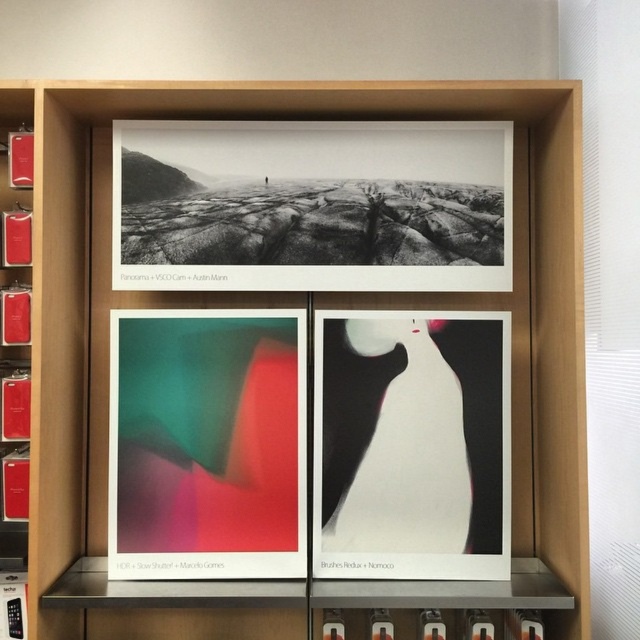
Is matte plastic poster at center above white glossy vase at center?

No, matte plastic poster at center is not above white glossy vase at center.

Does point (244, 336) lie in front of point (416, 458)?

No, (244, 336) is behind (416, 458).

Where is `matte plastic poster at center`? This screenshot has width=640, height=640. matte plastic poster at center is located at coordinates (205, 444).

Between point (221, 189) and point (120, 352), which one is positioned behind?

The point (221, 189) is behind.

Does black matte print at upper center appear on the left side of matte plastic poster at center?

Incorrect, black matte print at upper center is not on the left side of matte plastic poster at center.

Is point (282, 284) closer to viewer compared to point (304, 396)?

That is False.

At what (x,y) coordinates should I click in order to perform the action: click on black matte print at upper center. Please return your answer as a coordinate pair (x, y). The image size is (640, 640). Looking at the image, I should click on (312, 205).

Can you confirm if black matte print at upper center is positioned above white glossy vase at center?

Correct, black matte print at upper center is located above white glossy vase at center.

Which is more to the right, black matte print at upper center or white glossy vase at center?

Positioned to the right is white glossy vase at center.

Who is more forward, (465, 228) or (452, 525)?

Point (452, 525) is more forward.

Locate an element on the screen. This screenshot has height=640, width=640. black matte print at upper center is located at coordinates (312, 205).